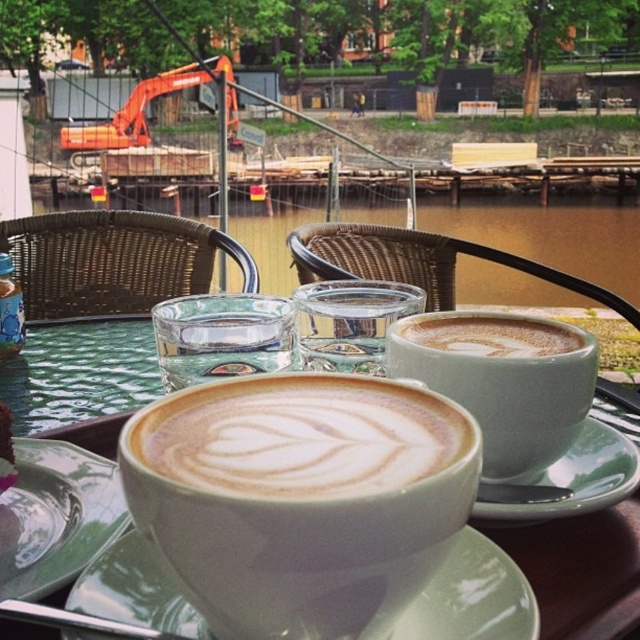
Question: From the image, what is the correct spatial relationship of latte art foam at center in relation to matte ceramic platter at center?

Choices:
 (A) below
 (B) above

Answer: (B)

Question: Considering the relative positions of latte art foam at center and green ceramic saucer at center in the image provided, where is latte art foam at center located with respect to green ceramic saucer at center?

Choices:
 (A) below
 (B) above

Answer: (B)

Question: Which object is the closest to the matte ceramic platter at center?

Choices:
 (A) cappuccino foam at center
 (B) white matte cappuccino at center
 (C) matte ceramic cup at center

Answer: (B)

Question: Does white matte cappuccino at center have a smaller size compared to white glossy saucer at center?

Choices:
 (A) yes
 (B) no

Answer: (B)

Question: Considering the real-world distances, which object is closest to the matte ceramic cups at center?

Choices:
 (A) latte art foam at center
 (B) white glossy saucer at center
 (C) green ceramic saucer at center
 (D) matte ceramic cup at center

Answer: (C)

Question: Which object appears farthest from the camera in this image?

Choices:
 (A) green ceramic saucer at center
 (B) white matte cappuccino at center
 (C) matte ceramic cups at center
 (D) matte ceramic cup at center

Answer: (D)